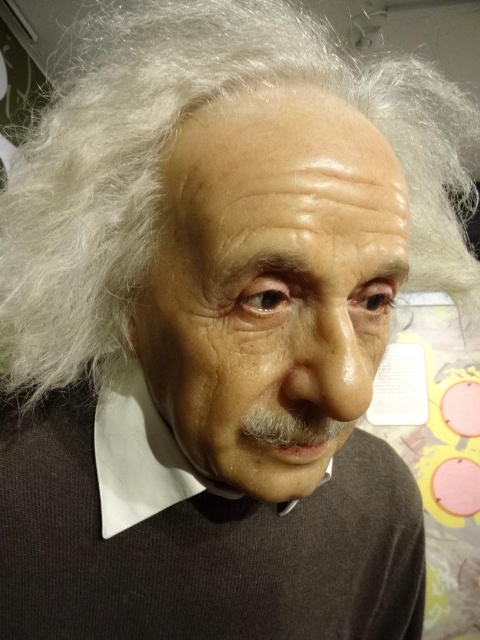
Question: Which is nearer to the white matte hair at center?

Choices:
 (A) white matte shirt at center
 (B) smooth skin face at center

Answer: (B)

Question: Which of the following is the closest to the observer?

Choices:
 (A) 235,387
 (B) 142,474

Answer: (A)

Question: Which of the following is the closest to the observer?

Choices:
 (A) smooth skin face at center
 (B) white matte hair at center
 (C) matte black sweater at center

Answer: (A)

Question: Does matte black sweater at center appear over white matte shirt at center?

Choices:
 (A) no
 (B) yes

Answer: (A)

Question: Does white matte hair at center have a smaller size compared to white matte shirt at center?

Choices:
 (A) yes
 (B) no

Answer: (B)

Question: Does smooth skin face at center appear under matte black sweater at center?

Choices:
 (A) yes
 (B) no

Answer: (B)